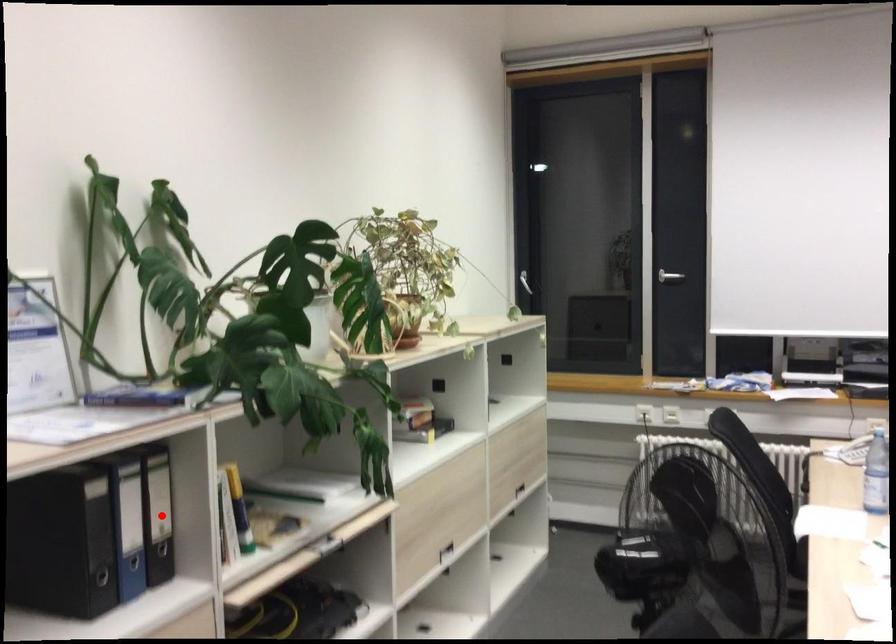
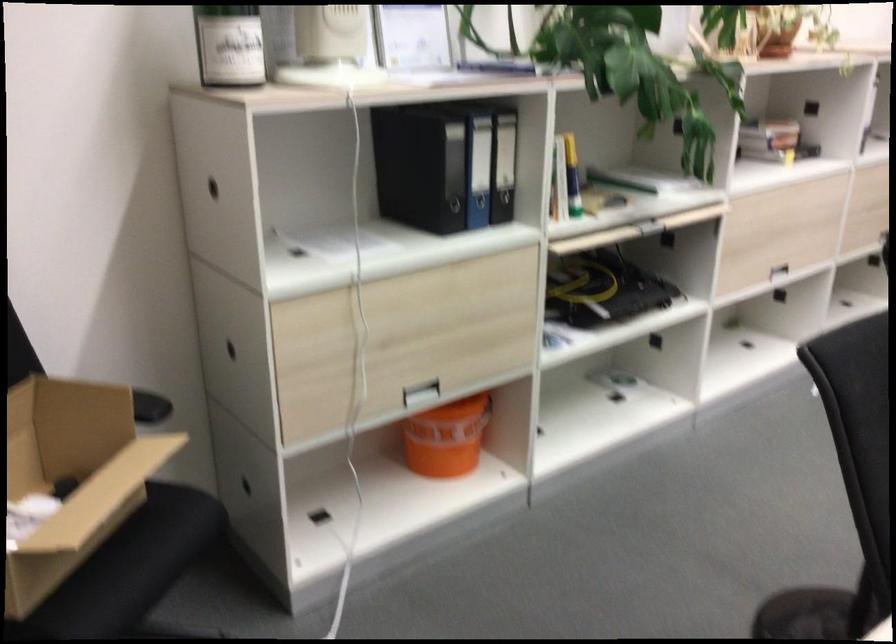
Where in the second image is the point corresponding to the highlighted location from the first image?

(504, 165)